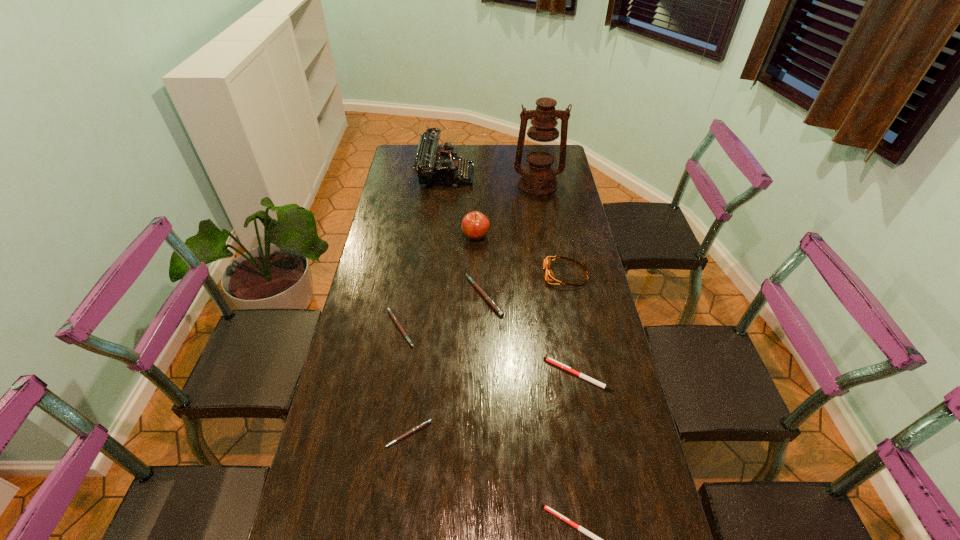
Locate an element on the screen. This screenshot has height=540, width=960. free space located at the nib of the tallest pen is located at coordinates (421, 296).

This screenshot has height=540, width=960. What are the coordinates of `vacant space situated 0.370m at the nib of the second biggest pink pen` in the screenshot? It's located at (532, 328).

Where is `free region located 0.380m on the clicker of the farther white pen`? This screenshot has width=960, height=540. free region located 0.380m on the clicker of the farther white pen is located at coordinates (415, 375).

Identify the location of free spot located 0.370m on the clicker of the farther white pen. This screenshot has width=960, height=540. [419, 375].

Locate an element on the screen. This screenshot has height=540, width=960. vacant space situated on the clicker of the farther white pen is located at coordinates (524, 375).

Where is `free spot located at the nib of the eighth farthest object`? This screenshot has height=540, width=960. free spot located at the nib of the eighth farthest object is located at coordinates (399, 516).

Image resolution: width=960 pixels, height=540 pixels. What are the coordinates of `object located in the far edge section of the desktop` in the screenshot? It's located at (435, 165).

The height and width of the screenshot is (540, 960). In order to click on typewriter situated at the left edge in this screenshot , I will do `click(435, 165)`.

Locate an element on the screen. The width and height of the screenshot is (960, 540). pen present at the left edge is located at coordinates (392, 315).

Locate an element on the screen. oil lamp at the right edge is located at coordinates (538, 178).